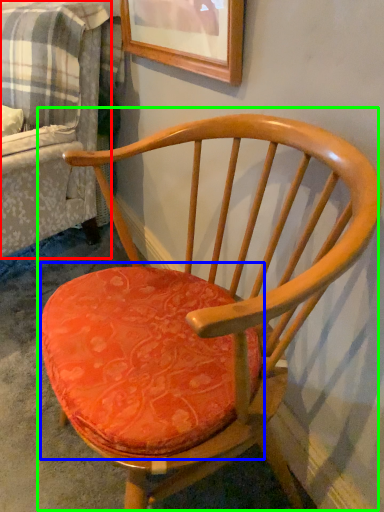
Question: Estimate the real-world distances between objects in this image. Which object is closer to couch (highlighted by a red box), table (highlighted by a blue box) or chair (highlighted by a green box)?

Choices:
 (A) table
 (B) chair

Answer: (B)